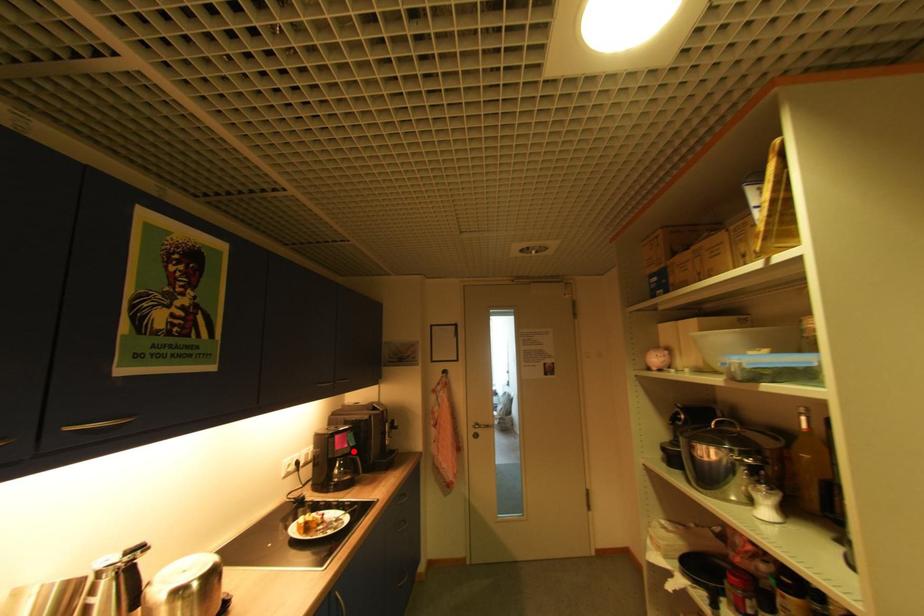
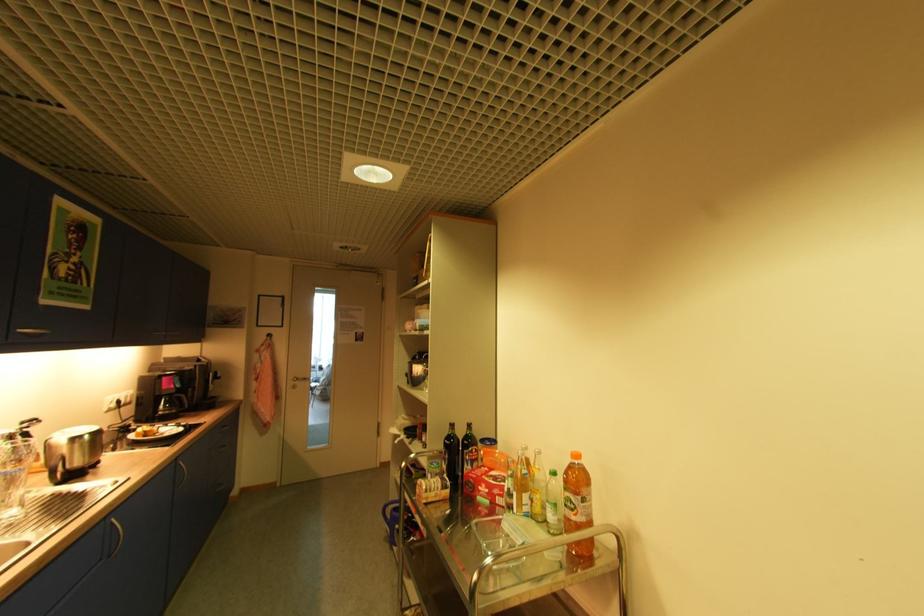
Question: I am providing you with two images of the same scene from different viewpoints. Image1 has a red point marked. In image2, the corresponding 3D location appears at what relative position? Reply with the corresponding letter.

Choices:
 (A) Closer
 (B) Farther

Answer: (A)